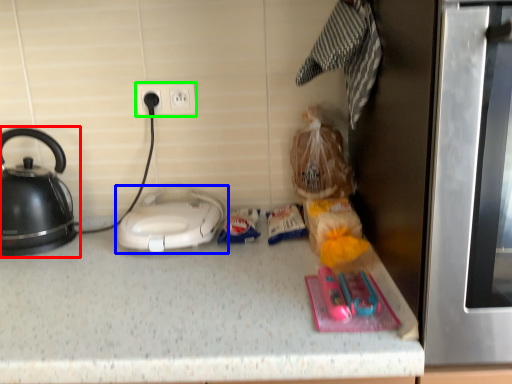
Question: Which object is the farthest from kettle (highlighted by a red box)? Choose among these: home appliance (highlighted by a blue box) or electric outlet (highlighted by a green box).

Choices:
 (A) home appliance
 (B) electric outlet

Answer: (B)